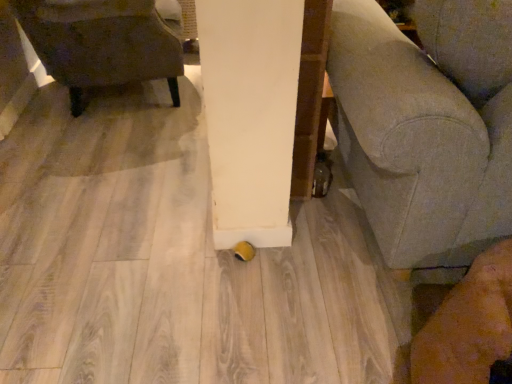
The height and width of the screenshot is (384, 512). Describe the element at coordinates (417, 144) in the screenshot. I see `gray fabric couch at lower right` at that location.

Find the location of a particular element. This screenshot has height=384, width=512. gray fabric couch at lower right is located at coordinates (417, 144).

Image resolution: width=512 pixels, height=384 pixels. What do you see at coordinates (101, 43) in the screenshot?
I see `dark brown leather chair at left` at bounding box center [101, 43].

Measure the distance between point (122, 24) and camera.

6.08 feet.

Find the location of a particular element. This screenshot has height=384, width=512. dark brown leather chair at left is located at coordinates (101, 43).

Locate an element on the screen. gray fabric couch at lower right is located at coordinates (417, 144).

Visually, is dark brown leather chair at left positioned to the left or to the right of gray fabric couch at lower right?

Clearly, dark brown leather chair at left is on the left of gray fabric couch at lower right in the image.

Considering the relative positions of dark brown leather chair at left and gray fabric couch at lower right in the image provided, is dark brown leather chair at left in front of gray fabric couch at lower right?

No, it is behind gray fabric couch at lower right.

Which is nearer, (x=91, y=39) or (x=466, y=199)?

The point (x=466, y=199) is more forward.

From the image's perspective, is dark brown leather chair at left under gray fabric couch at lower right?

No.

From a real-world perspective, is dark brown leather chair at left under gray fabric couch at lower right?

Indeed, from a real-world perspective, dark brown leather chair at left is positioned beneath gray fabric couch at lower right.

Is dark brown leather chair at left wider than gray fabric couch at lower right?

No.

In the scene shown: Considering the sizes of objects dark brown leather chair at left and gray fabric couch at lower right in the image provided, who is taller, dark brown leather chair at left or gray fabric couch at lower right?

With more height is gray fabric couch at lower right.

Based on their sizes in the image, would you say dark brown leather chair at left is bigger or smaller than gray fabric couch at lower right?

Clearly, dark brown leather chair at left is smaller in size than gray fabric couch at lower right.

Looking at this image, is gray fabric couch at lower right completely or partially inside dark brown leather chair at left?

That's incorrect, gray fabric couch at lower right is not inside dark brown leather chair at left.

Is dark brown leather chair at left not near gray fabric couch at lower right?

That's right, there is a large distance between dark brown leather chair at left and gray fabric couch at lower right.

Is dark brown leather chair at left oriented towards gray fabric couch at lower right?

No, dark brown leather chair at left is not aimed at gray fabric couch at lower right.

The image size is (512, 384). What are the coordinates of `chair that appears above the gray fabric couch at lower right (from the image's perspective)` in the screenshot? It's located at (101, 43).

Which is more to the left, gray fabric couch at lower right or dark brown leather chair at left?

dark brown leather chair at left.

Is gray fabric couch at lower right closer to camera compared to dark brown leather chair at left?

Yes, it is.

Is point (414, 94) behind point (172, 97)?

No, (414, 94) is closer to viewer.

From the image's perspective, who appears lower, gray fabric couch at lower right or dark brown leather chair at left?

gray fabric couch at lower right appears lower in the image.

From a real-world perspective, who is located higher, gray fabric couch at lower right or dark brown leather chair at left?

In real-world perspective, gray fabric couch at lower right is above.

Considering the relative sizes of gray fabric couch at lower right and dark brown leather chair at left in the image provided, is gray fabric couch at lower right thinner than dark brown leather chair at left?

No, gray fabric couch at lower right is not thinner than dark brown leather chair at left.

Is gray fabric couch at lower right taller than dark brown leather chair at left?

Indeed, gray fabric couch at lower right has a greater height compared to dark brown leather chair at left.

Considering the relative sizes of gray fabric couch at lower right and dark brown leather chair at left in the image provided, is gray fabric couch at lower right smaller than dark brown leather chair at left?

No, gray fabric couch at lower right is not smaller than dark brown leather chair at left.

Could dark brown leather chair at left be considered to be inside gray fabric couch at lower right?

No, gray fabric couch at lower right does not contain dark brown leather chair at left.

Is gray fabric couch at lower right positioned far away from dark brown leather chair at left?

That's right, there is a large distance between gray fabric couch at lower right and dark brown leather chair at left.

Is gray fabric couch at lower right looking in the opposite direction of dark brown leather chair at left?

gray fabric couch at lower right does not have its back to dark brown leather chair at left.

What's the angular difference between gray fabric couch at lower right and dark brown leather chair at left's facing directions?

72.2 degrees separate the facing orientations of gray fabric couch at lower right and dark brown leather chair at left.

At what (x,y) coordinates should I click in order to perform the action: click on chair above the gray fabric couch at lower right (from the image's perspective). Please return your answer as a coordinate pair (x, y). Looking at the image, I should click on (101, 43).

This screenshot has height=384, width=512. Identify the location of chair located on the left of gray fabric couch at lower right. (101, 43).

This screenshot has height=384, width=512. Identify the location of furniture in front of the dark brown leather chair at left. (417, 144).